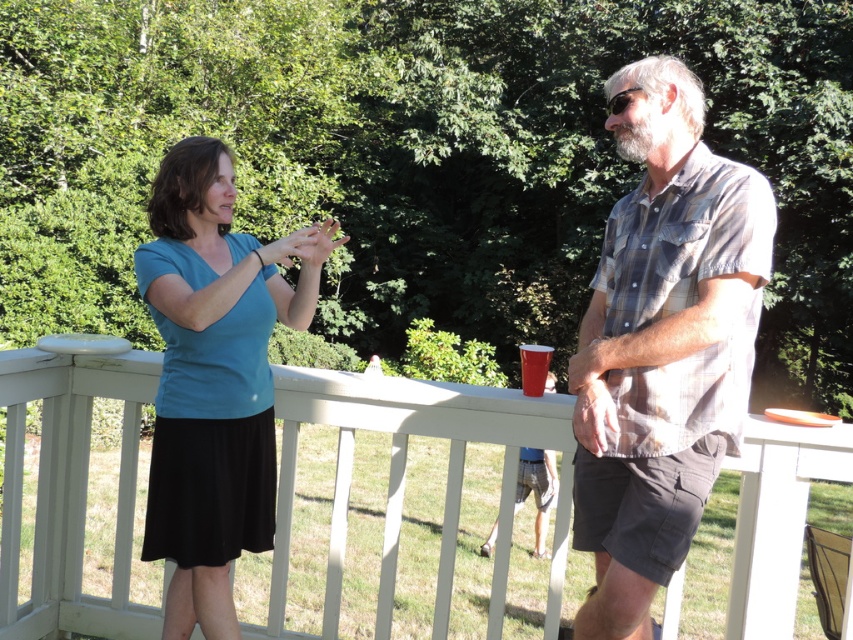
Question: Based on their relative distances, which object is nearer to the plaid cotton shirt at center?

Choices:
 (A) white wooden railing at upper center
 (B) red plastic cup at center
 (C) blue cotton shirt at upper center
 (D) matte blue shirt at center

Answer: (C)

Question: Is plaid cotton shirt at center below matte blue shirt at center?

Choices:
 (A) no
 (B) yes

Answer: (A)

Question: Is blue cotton shirt at upper center thinner than plaid cotton shirt at center?

Choices:
 (A) yes
 (B) no

Answer: (A)

Question: Which object is farther from the camera taking this photo?

Choices:
 (A) blue cotton shirt at upper center
 (B) red plastic cup at center
 (C) matte blue shirt at center

Answer: (B)

Question: Can you confirm if white wooden railing at upper center is bigger than blue cotton shirt at upper center?

Choices:
 (A) yes
 (B) no

Answer: (A)

Question: Which object is the farthest from the matte blue shirt at center?

Choices:
 (A) red plastic cup at center
 (B) plaid cotton shirt at center

Answer: (A)